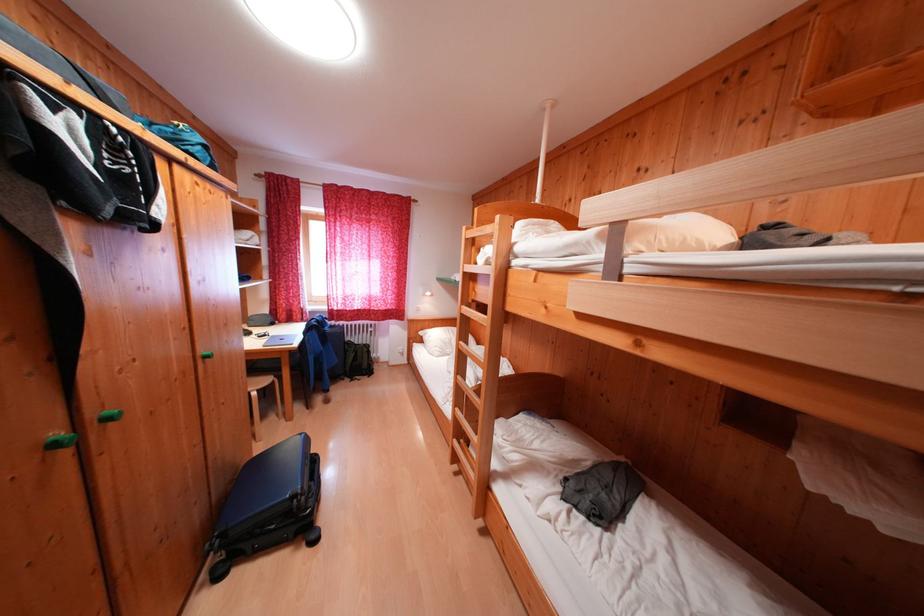
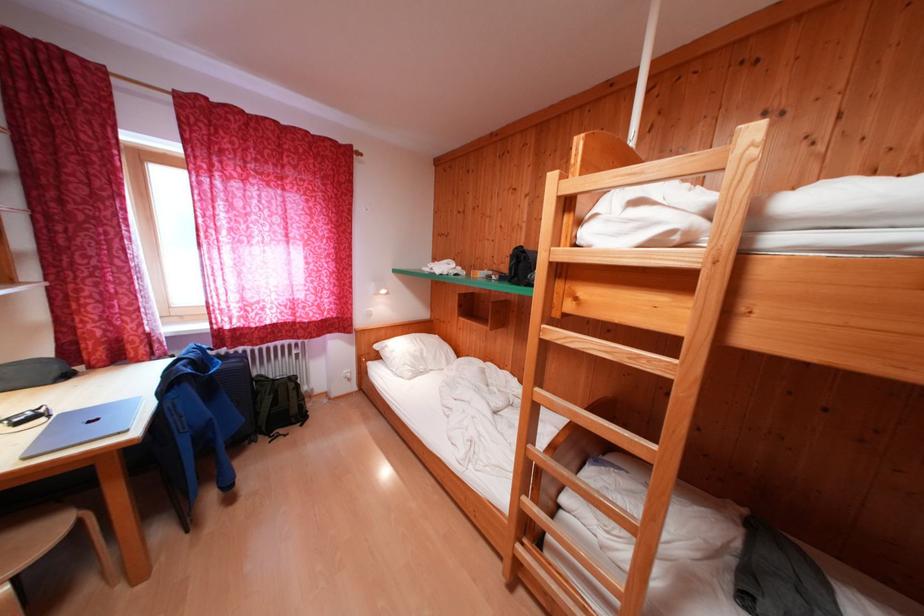
Which direction would the cameraman need to move to produce the second image?

The cameraman walked toward left, forward.